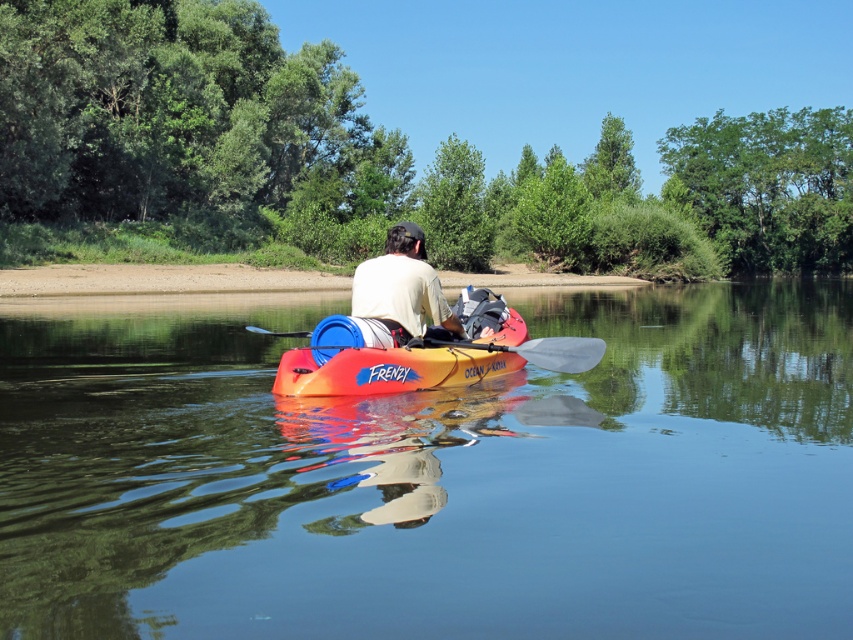
Can you confirm if transparent plastic kayak at center is positioned above white plastic paddle at center?

Indeed, transparent plastic kayak at center is positioned over white plastic paddle at center.

Is point (45, 301) positioned after point (585, 365)?

Yes, point (45, 301) is behind point (585, 365).

Find the location of `transparent plastic kayak at center`. transparent plastic kayak at center is located at coordinates (431, 476).

Can you confirm if matte white shirt at center is positioned above translucent plastic paddle at center?

Yes.

Where is `matte white shirt at center`? matte white shirt at center is located at coordinates (401, 288).

Which is behind, point (583, 362) or point (296, 336)?

Point (296, 336)

What do you see at coordinates (543, 352) in the screenshot? The image size is (853, 640). I see `white plastic paddle at center` at bounding box center [543, 352].

The image size is (853, 640). Identify the location of white plastic paddle at center. (543, 352).